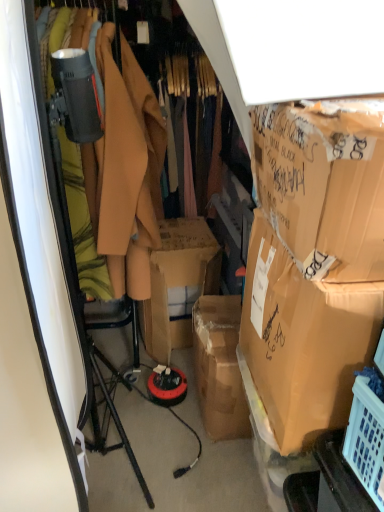
Question: Considering the positions of brown cardboard box at right, which is counted as the second box, starting from the top, and matte brown coat at center in the image, is brown cardboard box at right, which is counted as the second box, starting from the top, wider or thinner than matte brown coat at center?

Choices:
 (A) thin
 (B) wide

Answer: (B)

Question: Does point (357, 364) appear closer or farther from the camera than point (150, 140)?

Choices:
 (A) farther
 (B) closer

Answer: (B)

Question: Estimate the real-world distances between objects in this image. Which object is closer to the brown cardboard box at right, acting as the second box starting from the bottom?

Choices:
 (A) matte brown coat at center
 (B) brown cardboard box at right, which is counted as the second box, starting from the top

Answer: (B)

Question: Based on their relative distances, which object is nearer to the matte brown coat at center?

Choices:
 (A) brown cardboard box at right, which is counted as the second box, starting from the top
 (B) brown cardboard box at right, placed as the first box when sorted from top to bottom

Answer: (A)